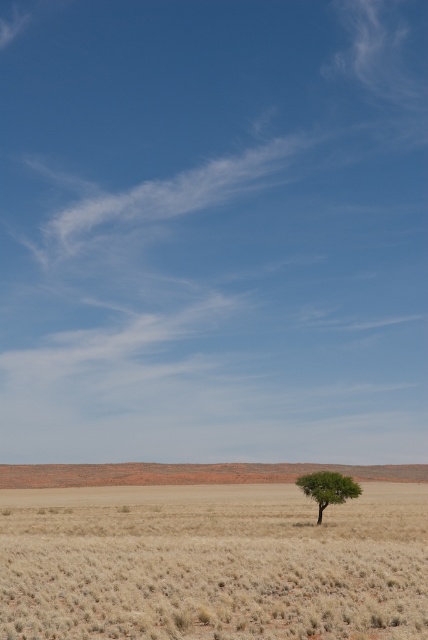
Does point (336, 602) come in front of point (318, 476)?

Yes.

In the scene shown: Between dry grass at center and green leafy tree at center, which one appears on the left side from the viewer's perspective?

dry grass at center

Is point (12, 541) positioned in front of point (324, 506)?

Yes, point (12, 541) is closer to viewer.

Identify the location of dry grass at center. (213, 563).